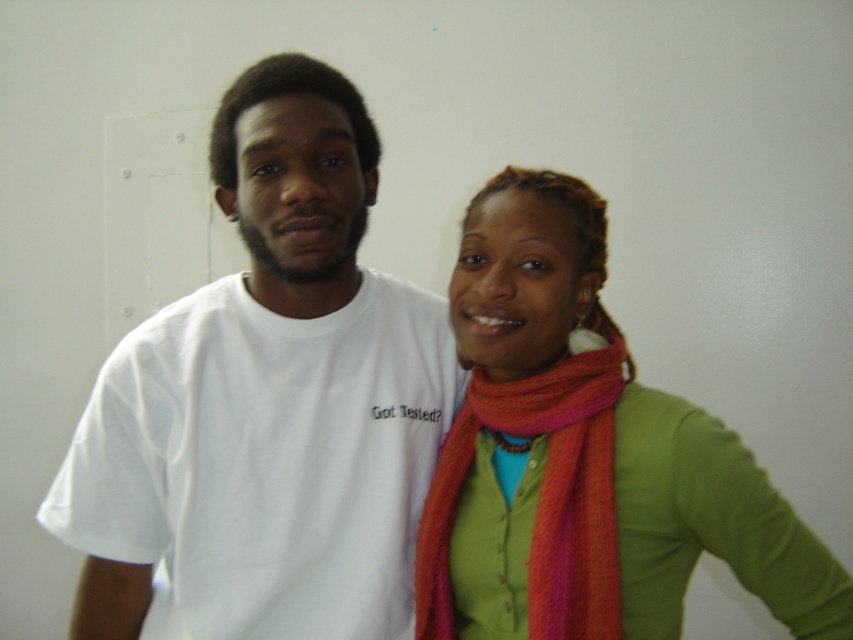
Is green matte scarf at center taller than orange woolen scarf at center?

Yes.

Which is below, green matte scarf at center or orange woolen scarf at center?

orange woolen scarf at center is below.

The height and width of the screenshot is (640, 853). Describe the element at coordinates (585, 456) in the screenshot. I see `green matte scarf at center` at that location.

Locate an element on the screen. Image resolution: width=853 pixels, height=640 pixels. green matte scarf at center is located at coordinates tap(585, 456).

Between point (152, 493) and point (599, 513), which one is positioned in front?

Point (599, 513) is more forward.

Is white cotton t-shirt at left positioned before green matte scarf at center?

No, it is not.

The width and height of the screenshot is (853, 640). Describe the element at coordinates (268, 401) in the screenshot. I see `white cotton t-shirt at left` at that location.

Find the location of a particular element. The width and height of the screenshot is (853, 640). white cotton t-shirt at left is located at coordinates tap(268, 401).

Between white cotton t-shirt at left and orange woolen scarf at center, which one has more height?

Standing taller between the two is white cotton t-shirt at left.

Who is more forward, (335, 365) or (432, 512)?

Point (335, 365)

The height and width of the screenshot is (640, 853). I want to click on white cotton t-shirt at left, so click(x=268, y=401).